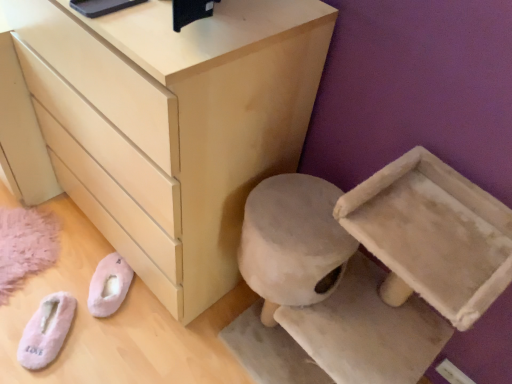
Question: Considering the relative sizes of pink fluffy slippers at lower left, which ranks as the first footwear in left-to-right order, and pink fuzzy slippers at lower left, the 1th footwear from the right, in the image provided, is pink fluffy slippers at lower left, which ranks as the first footwear in left-to-right order, taller than pink fuzzy slippers at lower left, the 1th footwear from the right,?

Choices:
 (A) no
 (B) yes

Answer: (A)

Question: Is pink fluffy slippers at lower left, which is counted as the second footwear, starting from the right, to the left of pink fuzzy slippers at lower left, the 1th footwear from the right, from the viewer's perspective?

Choices:
 (A) yes
 (B) no

Answer: (A)

Question: From the image's perspective, is pink fluffy slippers at lower left, which is counted as the second footwear, starting from the right, above pink fuzzy slippers at lower left, the second footwear when ordered from left to right?

Choices:
 (A) yes
 (B) no

Answer: (B)

Question: From a real-world perspective, is pink fluffy slippers at lower left, which is counted as the second footwear, starting from the right, beneath pink fuzzy slippers at lower left, the 1th footwear from the right?

Choices:
 (A) yes
 (B) no

Answer: (A)

Question: From a real-world perspective, is pink fluffy slippers at lower left, which ranks as the first footwear in left-to-right order, located higher than pink fuzzy slippers at lower left, the second footwear when ordered from left to right?

Choices:
 (A) yes
 (B) no

Answer: (B)

Question: Is point (169, 296) positioned closer to the camera than point (57, 347)?

Choices:
 (A) closer
 (B) farther

Answer: (A)

Question: Is matte light wood chest of drawers at center situated inside pink fluffy slippers at lower left, which is counted as the second footwear, starting from the right, or outside?

Choices:
 (A) outside
 (B) inside

Answer: (A)

Question: From a real-world perspective, is matte light wood chest of drawers at center above or below pink fluffy slippers at lower left, which is counted as the second footwear, starting from the right?

Choices:
 (A) below
 (B) above

Answer: (B)

Question: Considering the relative positions of matte light wood chest of drawers at center and pink fluffy slippers at lower left, which ranks as the first footwear in left-to-right order, in the image provided, is matte light wood chest of drawers at center to the left or to the right of pink fluffy slippers at lower left, which ranks as the first footwear in left-to-right order,?

Choices:
 (A) left
 (B) right

Answer: (B)

Question: Is point (47, 329) positioned closer to the camera than point (208, 36)?

Choices:
 (A) farther
 (B) closer

Answer: (A)

Question: From a real-world perspective, is pink fluffy slippers at lower left, which is counted as the second footwear, starting from the right, positioned above or below matte light wood chest of drawers at center?

Choices:
 (A) above
 (B) below

Answer: (B)

Question: From the image's perspective, is pink fluffy slippers at lower left, which is counted as the second footwear, starting from the right, located above or below matte light wood chest of drawers at center?

Choices:
 (A) below
 (B) above

Answer: (A)

Question: Is pink fluffy slippers at lower left, which is counted as the second footwear, starting from the right, spatially inside matte light wood chest of drawers at center, or outside of it?

Choices:
 (A) inside
 (B) outside

Answer: (B)

Question: From a real-world perspective, is pink fuzzy slippers at lower left, the second footwear when ordered from left to right, positioned above or below matte light wood chest of drawers at center?

Choices:
 (A) above
 (B) below

Answer: (B)

Question: Looking at their shapes, would you say pink fuzzy slippers at lower left, the second footwear when ordered from left to right, is wider or thinner than matte light wood chest of drawers at center?

Choices:
 (A) wide
 (B) thin

Answer: (B)